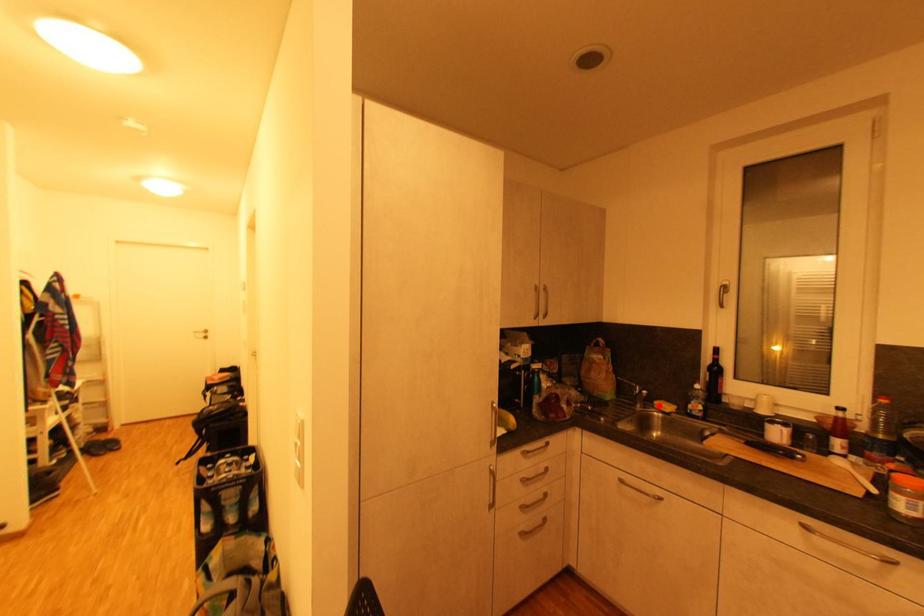
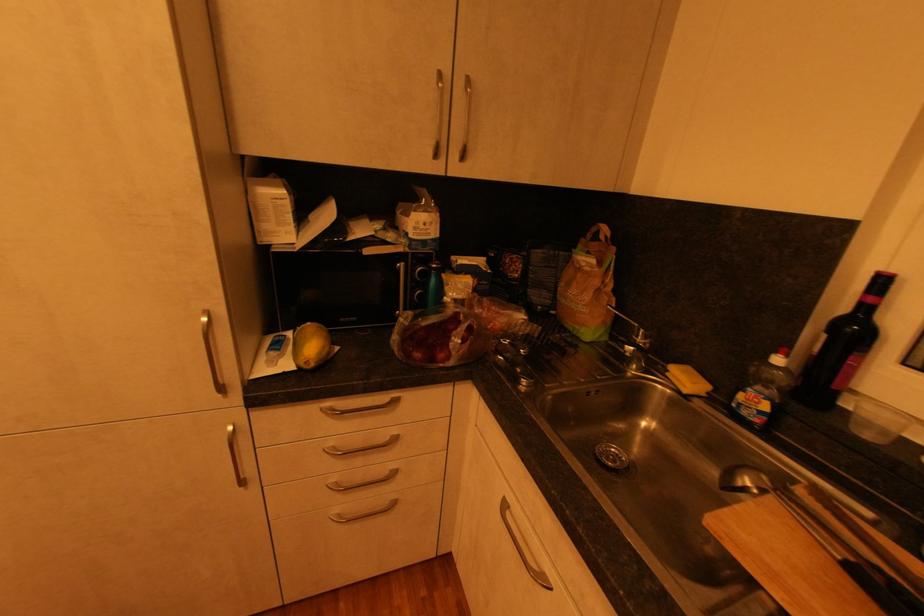
Find the pixel in the second image that matches the highlighted location in the first image.

(672, 371)